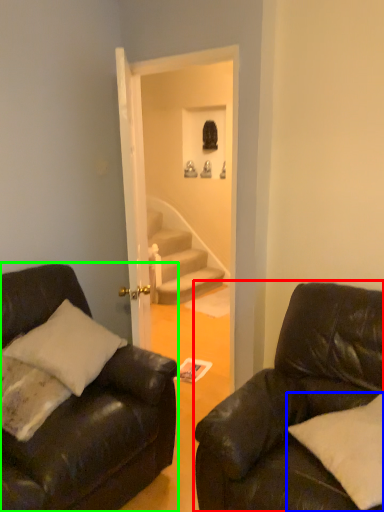
Question: Which is nearer to the studio couch (highlighted by a red box)? pillow (highlighted by a blue box) or studio couch (highlighted by a green box).

Choices:
 (A) pillow
 (B) studio couch

Answer: (A)